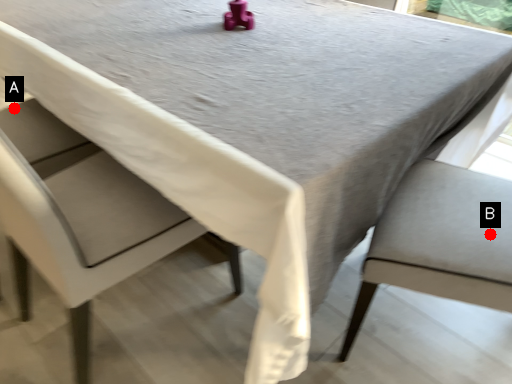
Question: Two points are circled on the image, labeled by A and B beside each circle. Which point appears closest to the camera in this image?

Choices:
 (A) A is closer
 (B) B is closer

Answer: (B)